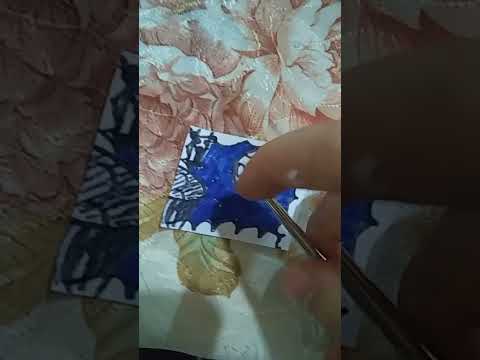
Where is `painted dark blue area`? painted dark blue area is located at coordinates [x=221, y=209].